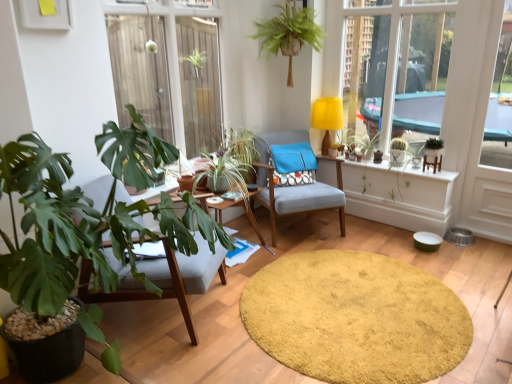
Find the location of a particular element. free location above yellow shaggy rug at center (from a real-world perspective) is located at coordinates (340, 317).